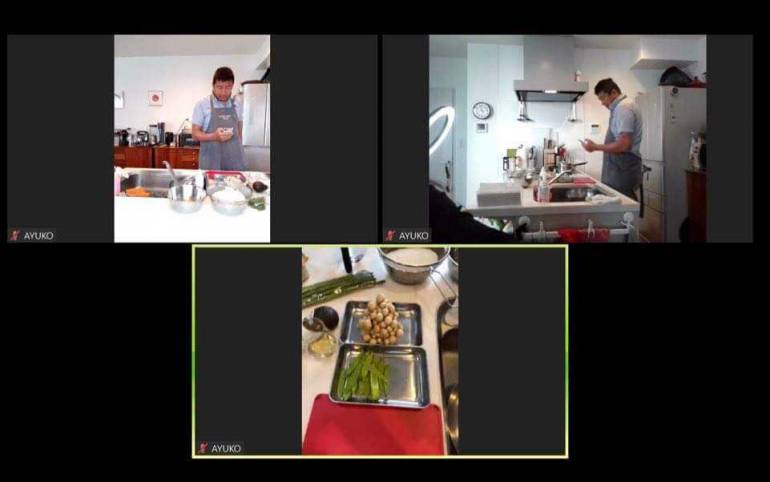
Image resolution: width=770 pixels, height=482 pixels. Identify the location of rectangular shaped photographs. pyautogui.click(x=186, y=77), pyautogui.click(x=521, y=84), pyautogui.click(x=397, y=317).